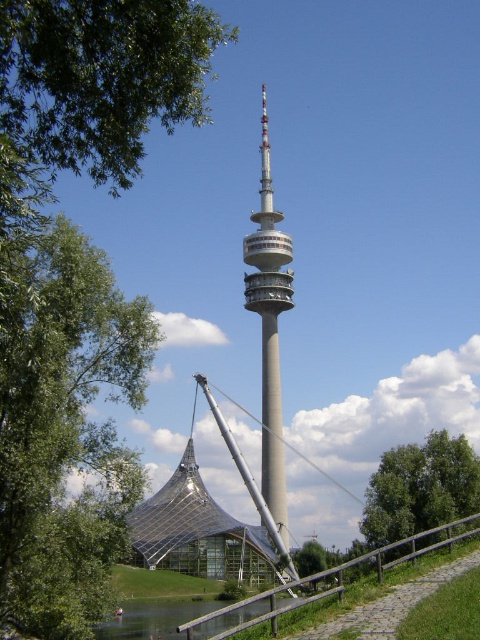
Question: Based on their relative distances, which object is nearer to the green leafy tree at lower right?

Choices:
 (A) silver metallic tower at center
 (B) transparent glass tent at center

Answer: (B)

Question: In this image, where is green leafy tree at left located relative to transparent glass tent at center?

Choices:
 (A) below
 (B) above

Answer: (B)

Question: Which point is farther to the camera?

Choices:
 (A) (250, 532)
 (B) (122, 332)

Answer: (A)

Question: Estimate the real-world distances between objects in this image. Which object is closer to the silver metallic tower at center?

Choices:
 (A) green leafy tree at lower right
 (B) transparent glass tent at center

Answer: (B)

Question: Does transparent glass tent at center have a greater width compared to silver metallic tower at center?

Choices:
 (A) yes
 (B) no

Answer: (A)

Question: Is transparent glass tent at center to the left of green leafy tree at lower right from the viewer's perspective?

Choices:
 (A) yes
 (B) no

Answer: (A)